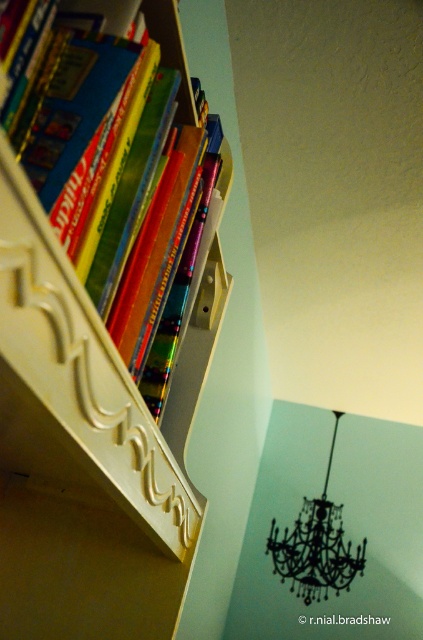
You are organizing books on a shelf and notice the matte blue book at left and the white carved wood drawer at upper left. Which object is located to the right of the other?

The matte blue book at left is positioned on the right side of white carved wood drawer at upper left, so the matte blue book at left is to the right of the white carved wood drawer at upper left.

You are an interior designer assessing the placement of the white carved wood drawer at upper left and the black crystal chandelier at upper center. Based on their heights, which object would you recommend lowering to create a more balanced aesthetic?

The black crystal chandelier at upper center should be lowered because it is taller than the white carved wood drawer at upper left, so adjusting its height would help achieve a more balanced look.